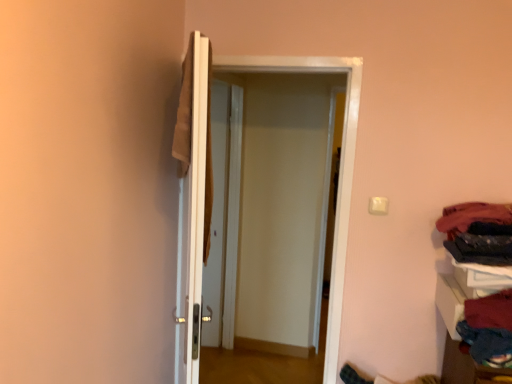
Question: Is black fabric at right, arranged as the second clothing when viewed from the top, inside or outside of white glossy door at center, which is counted as the first door, starting from the left?

Choices:
 (A) inside
 (B) outside

Answer: (B)

Question: Is point (498, 251) closer or farther from the camera than point (200, 304)?

Choices:
 (A) farther
 (B) closer

Answer: (A)

Question: Based on their relative distances, which object is nearer to the velvet red sweater at lower right, which is the 3th clothing in top-to-bottom order?

Choices:
 (A) dark blue fabric at right, the 3th clothing ordered from the bottom
 (B) white glossy door at center, which is counted as the second door, starting from the left
 (C) white glossy door at center, which is counted as the first door, starting from the left
 (D) black fabric at right, arranged as the second clothing when viewed from the top

Answer: (D)

Question: Based on their relative distances, which object is nearer to the dark blue fabric at right, which is the 1th clothing from top to bottom?

Choices:
 (A) white glossy door at center, which is counted as the first door, starting from the right
 (B) velvet red sweater at lower right, which is the 1th clothing in bottom-to-top order
 (C) black fabric at right, positioned as the 2th clothing in bottom-to-top order
 (D) white glossy door at center, which is counted as the first door, starting from the left

Answer: (C)